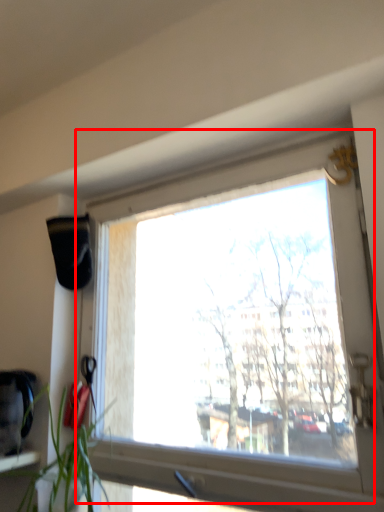
Question: From the image's perspective, where is window (annotated by the red box) located in relation to houseplant in the image?

Choices:
 (A) below
 (B) above

Answer: (B)